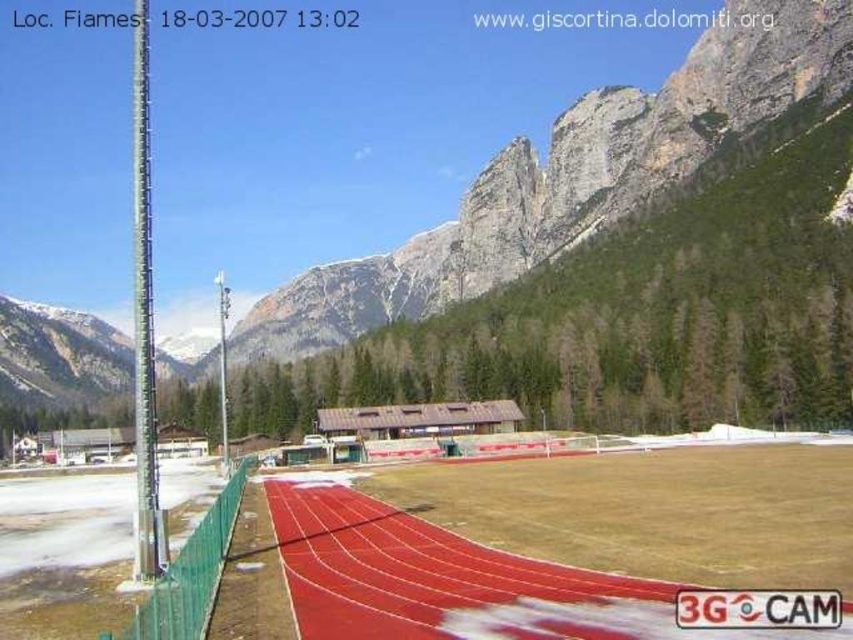
Question: Which point appears farthest from the camera in this image?

Choices:
 (A) (140, 368)
 (B) (229, 465)

Answer: (B)

Question: Which of the following is the closest to the observer?

Choices:
 (A) green metallic pole at left
 (B) metallic pole at center

Answer: (A)

Question: In this image, where is green metallic pole at left located relative to metallic pole at center?

Choices:
 (A) above
 (B) below

Answer: (A)

Question: Which of the following is the closest to the observer?

Choices:
 (A) green metallic pole at left
 (B) metallic pole at center

Answer: (A)

Question: Does green metallic pole at left appear on the right side of metallic pole at center?

Choices:
 (A) yes
 (B) no

Answer: (B)

Question: Can you confirm if green metallic pole at left is smaller than metallic pole at center?

Choices:
 (A) yes
 (B) no

Answer: (B)